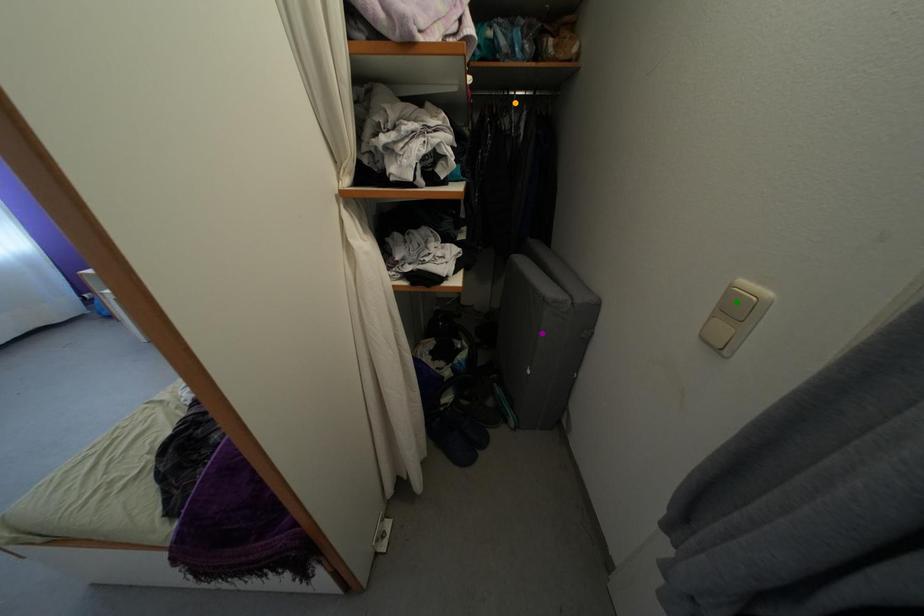
Order these from nearest to farthest:
1. purple point
2. green point
3. orange point

1. orange point
2. purple point
3. green point